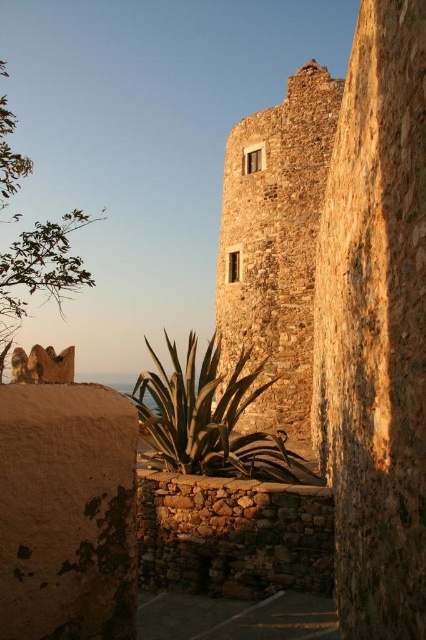
You are standing in front of the stone structure and want to determine which object is taller between the rustic stone tower at center and the green leafy plant at center. Based on the scene, which one is taller?

The rustic stone tower at center is taller than the green leafy plant at center.

You are an architect examining the historical site. You need to determine the spatial relationship between the green leafy plant at center and the rustic stone tower at center. Which one is closer to the viewer?

The rustic stone tower at center is closer to the viewer than the green leafy plant at center, as the plant is positioned behind the tower.